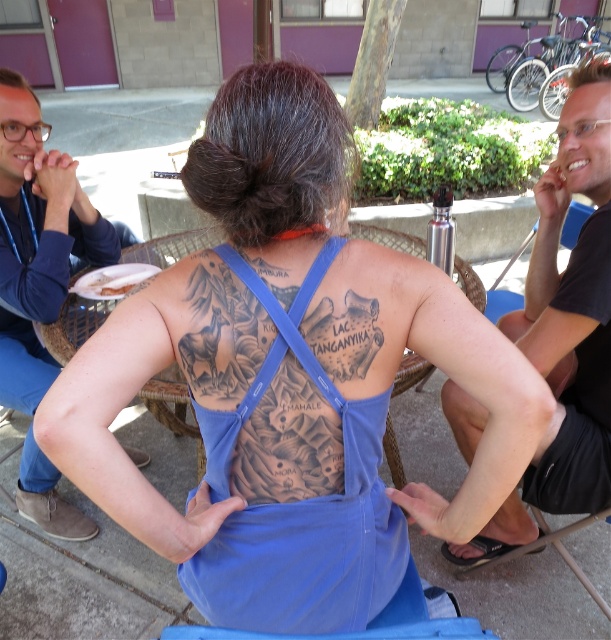
Where is `black matte water bottle at upper center`? The height and width of the screenshot is (640, 611). black matte water bottle at upper center is located at coordinates (573, 307).

Is black matte water bottle at upper center wider than blue denim jeans at left?

No, black matte water bottle at upper center is not wider than blue denim jeans at left.

Where is `black matte water bottle at upper center`? The image size is (611, 640). black matte water bottle at upper center is located at coordinates (573, 307).

This screenshot has width=611, height=640. Find the location of `black matte water bottle at upper center`. black matte water bottle at upper center is located at coordinates (573, 307).

Is point (584, 340) positioned in front of point (114, 269)?

Yes.

Between point (529, 307) and point (108, 282), which one is positioned behind?

Point (108, 282)

Between point (606, 240) and point (114, 268), which one is positioned in front?

Positioned in front is point (606, 240).

Where is `black matte water bottle at upper center`? black matte water bottle at upper center is located at coordinates [573, 307].

Can you confirm if blue denim jeans at left is bigger than white paper napkin at upper left?

Yes.

Between point (56, 310) and point (152, 268), which one is positioned behind?

Point (152, 268)

The image size is (611, 640). Find the location of `blue denim jeans at left`. blue denim jeans at left is located at coordinates (37, 241).